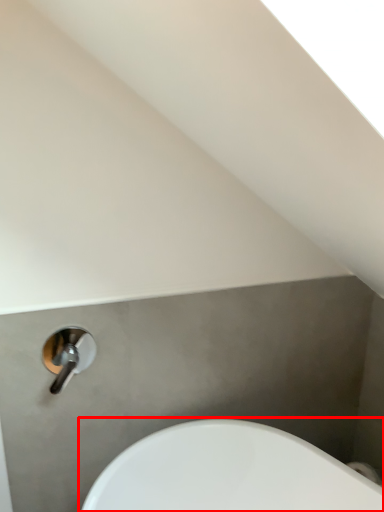
Question: Observing the image, what is the correct spatial positioning of sink (annotated by the red box) in reference to tap?

Choices:
 (A) right
 (B) left

Answer: (A)